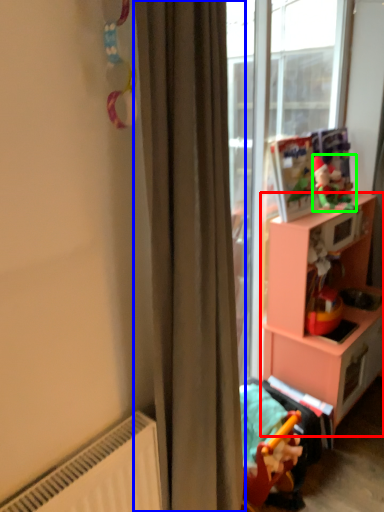
Question: Estimate the real-world distances between objects in this image. Which object is closer to cabinetry (highlighted by a red box), curtain (highlighted by a blue box) or toy (highlighted by a green box)?

Choices:
 (A) curtain
 (B) toy

Answer: (B)